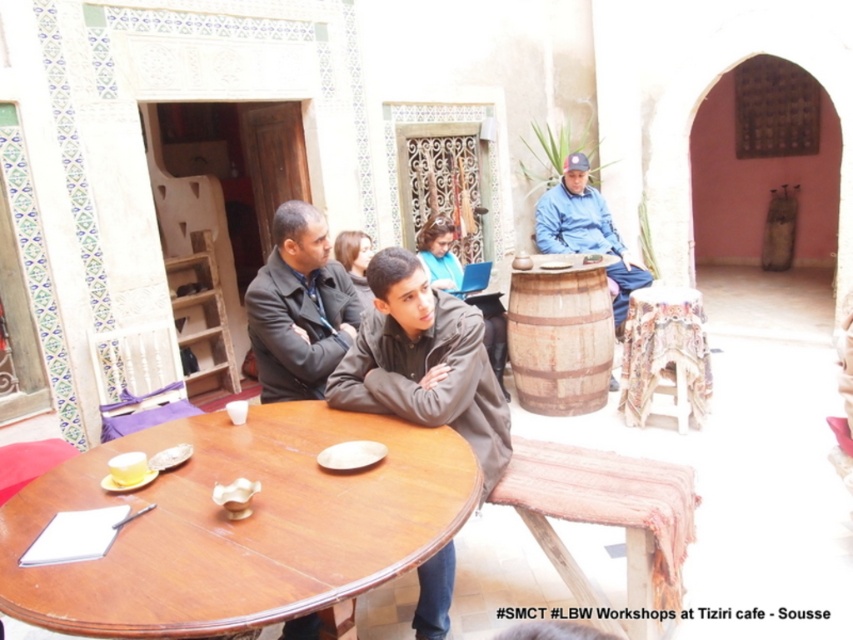
You are a guest at the Moroccan courtyard event. You see the dark gray suit at center and the wooden barrel at center. Which object is positioned to the left side of the other?

The dark gray suit at center is to the left of wooden barrel at center.

You are a visitor at the Moroccan courtyard and want to place a small golden bowl on the patterned fabric table at center. However, you notice a blue denim jacket at center nearby. Considering their heights, will the bowl be visible above the jacket?

The patterned fabric table at center is shorter than the blue denim jacket at center, so placing the small golden bowl on the table would result in it being obscured by the jacket.